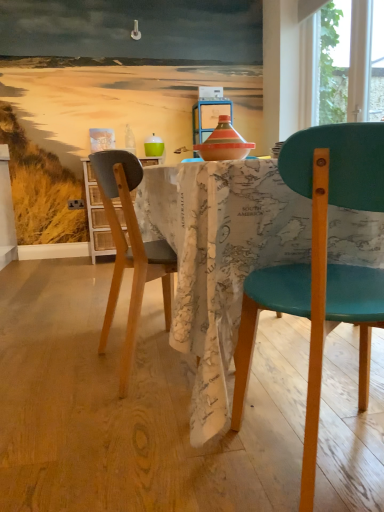
Question: From the image's perspective, is map-patterned fabric at center located above wooden cabinet at left?

Choices:
 (A) yes
 (B) no

Answer: (B)

Question: Does map-patterned fabric at center have a lesser width compared to wooden cabinet at left?

Choices:
 (A) no
 (B) yes

Answer: (A)

Question: Does map-patterned fabric at center have a larger size compared to wooden cabinet at left?

Choices:
 (A) no
 (B) yes

Answer: (B)

Question: Could you tell me if map-patterned fabric at center is facing wooden cabinet at left?

Choices:
 (A) yes
 (B) no

Answer: (B)

Question: Does map-patterned fabric at center have a lesser height compared to wooden cabinet at left?

Choices:
 (A) yes
 (B) no

Answer: (A)

Question: From a real-world perspective, is teal plastic chair at right, which ranks as the 1th chair in right-to-left order, physically located above or below white plastic power outlet at lower left?

Choices:
 (A) below
 (B) above

Answer: (A)

Question: Considering the positions of teal plastic chair at right, which ranks as the 1th chair in right-to-left order, and white plastic power outlet at lower left in the image, is teal plastic chair at right, which ranks as the 1th chair in right-to-left order, bigger or smaller than white plastic power outlet at lower left?

Choices:
 (A) small
 (B) big

Answer: (B)

Question: Considering the positions of point (311, 136) and point (77, 201), is point (311, 136) closer or farther from the camera than point (77, 201)?

Choices:
 (A) closer
 (B) farther

Answer: (A)

Question: Looking at their shapes, would you say teal plastic chair at right, the second chair when ordered from left to right, is wider or thinner than white plastic power outlet at lower left?

Choices:
 (A) thin
 (B) wide

Answer: (B)

Question: From a real-world perspective, is map-patterned fabric at center above or below translucent glass bottle at upper center?

Choices:
 (A) above
 (B) below

Answer: (B)

Question: Is map-patterned fabric at center wider or thinner than translucent glass bottle at upper center?

Choices:
 (A) wide
 (B) thin

Answer: (A)

Question: Considering their positions, is map-patterned fabric at center located in front of or behind translucent glass bottle at upper center?

Choices:
 (A) behind
 (B) front

Answer: (B)

Question: In terms of size, does map-patterned fabric at center appear bigger or smaller than translucent glass bottle at upper center?

Choices:
 (A) big
 (B) small

Answer: (A)

Question: Looking at their shapes, would you say map-patterned fabric at center is wider or thinner than transparent glass window at upper right?

Choices:
 (A) thin
 (B) wide

Answer: (B)

Question: In terms of size, does map-patterned fabric at center appear bigger or smaller than transparent glass window at upper right?

Choices:
 (A) big
 (B) small

Answer: (A)